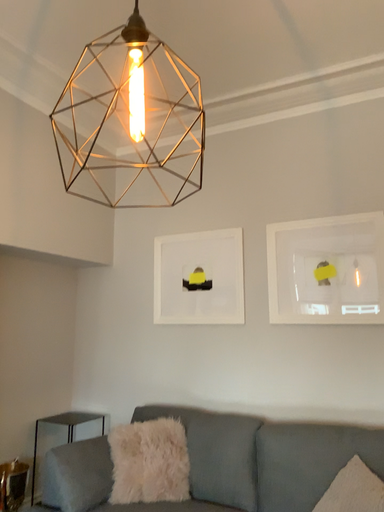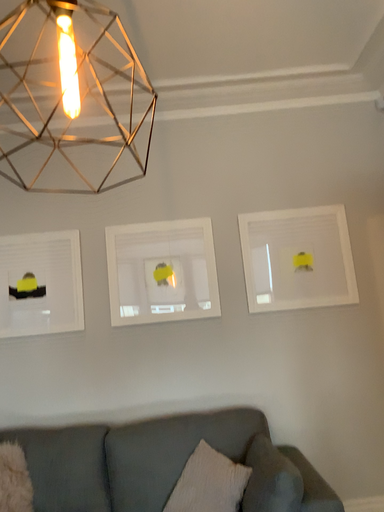
Question: Which way did the camera rotate in the video?

Choices:
 (A) rotated right
 (B) rotated left

Answer: (A)